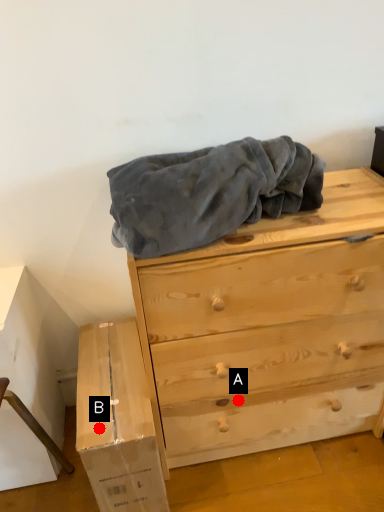
Question: Two points are circled on the image, labeled by A and B beside each circle. Which point is farther from the camera taking this photo?

Choices:
 (A) A is further
 (B) B is further

Answer: (A)